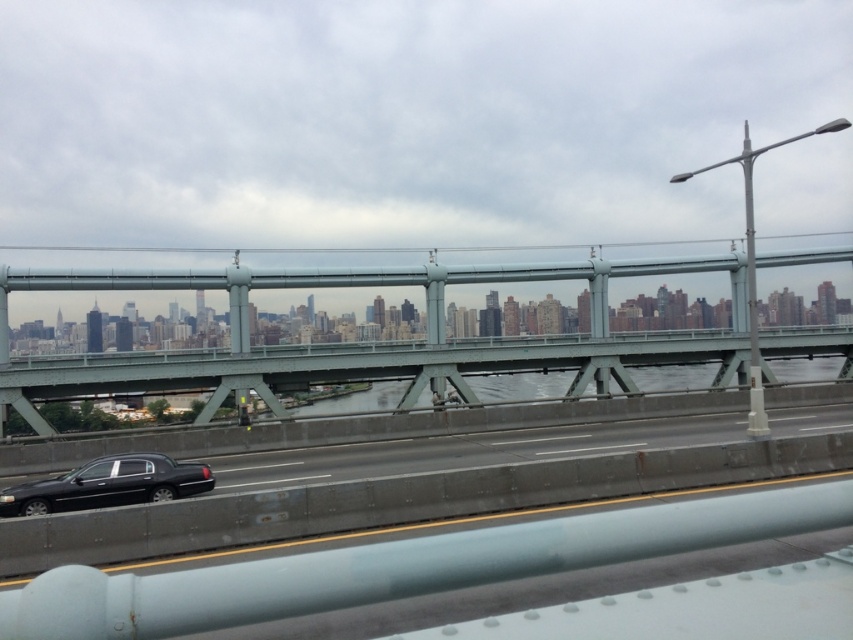
Question: Estimate the real-world distances between objects in this image. Which object is farther from the black glossy car at lower left?

Choices:
 (A) green metallic bridge at center
 (B) black glossy sedan at lower left

Answer: (A)

Question: Which point is closer to the camera?

Choices:
 (A) black glossy sedan at lower left
 (B) black glossy car at lower left
 (C) green metallic bridge at center

Answer: (B)

Question: Observing the image, what is the correct spatial positioning of green metallic bridge at center in reference to black glossy sedan at lower left?

Choices:
 (A) above
 (B) below

Answer: (A)

Question: Which object is the closest to the green metallic bridge at center?

Choices:
 (A) black glossy sedan at lower left
 (B) black glossy car at lower left

Answer: (B)

Question: Is black glossy car at lower left thinner than black glossy sedan at lower left?

Choices:
 (A) yes
 (B) no

Answer: (B)

Question: Does black glossy car at lower left have a larger size compared to black glossy sedan at lower left?

Choices:
 (A) no
 (B) yes

Answer: (B)